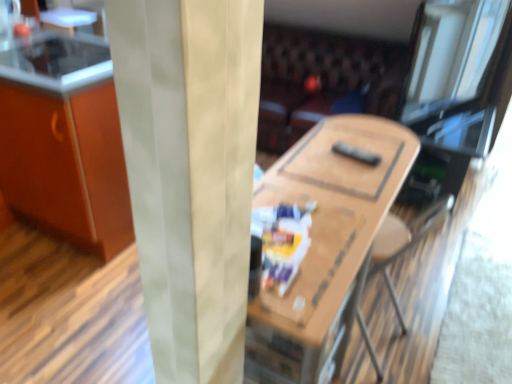
Question: Considering the positions of leather couch at center and smooth glass counter top at upper left in the image, is leather couch at center wider or thinner than smooth glass counter top at upper left?

Choices:
 (A) wide
 (B) thin

Answer: (A)

Question: Considering the positions of point (260, 99) and point (3, 57), is point (260, 99) closer or farther from the camera than point (3, 57)?

Choices:
 (A) closer
 (B) farther

Answer: (B)

Question: Estimate the real-world distances between objects in this image. Which object is farther from the leather couch at center?

Choices:
 (A) orange matte cabinet at left
 (B) smooth glass counter top at upper left
 (C) wooden table at center

Answer: (B)

Question: Which is nearer to the smooth glass counter top at upper left?

Choices:
 (A) leather couch at center
 (B) orange matte cabinet at left
 (C) wooden table at center

Answer: (B)